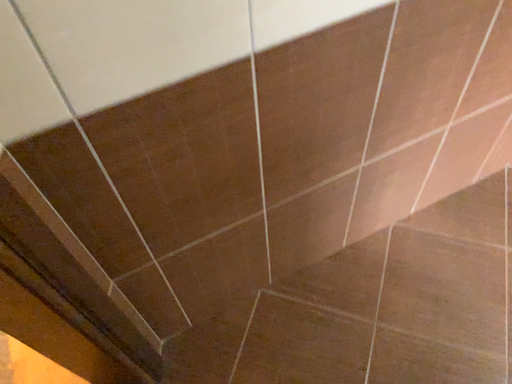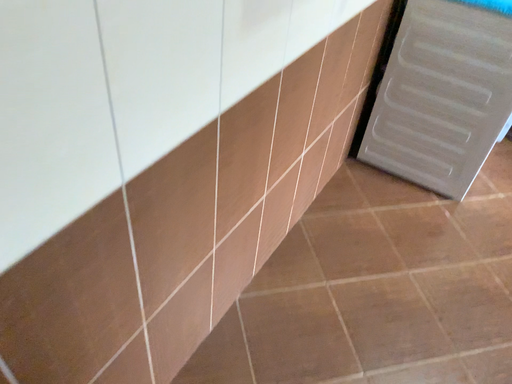
Question: Which way did the camera rotate in the video?

Choices:
 (A) rotated left
 (B) rotated right

Answer: (B)